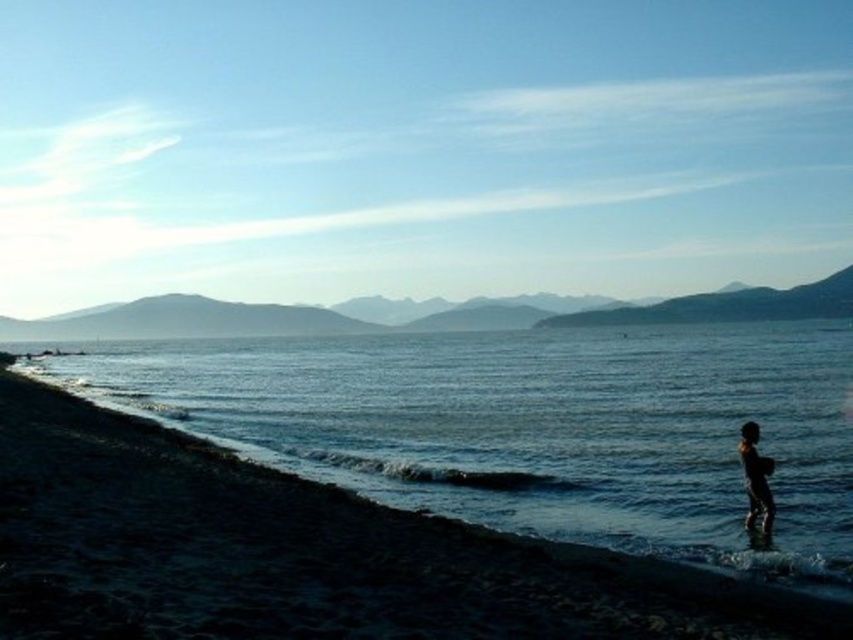
You are standing on the beach and see the dark blue water at lower left and the dark skin human at lower right. Which object is closer to the bottom edge of the image?

The dark blue water at lower left is closer to the bottom edge of the image because it is positioned below the dark skin human at lower right.